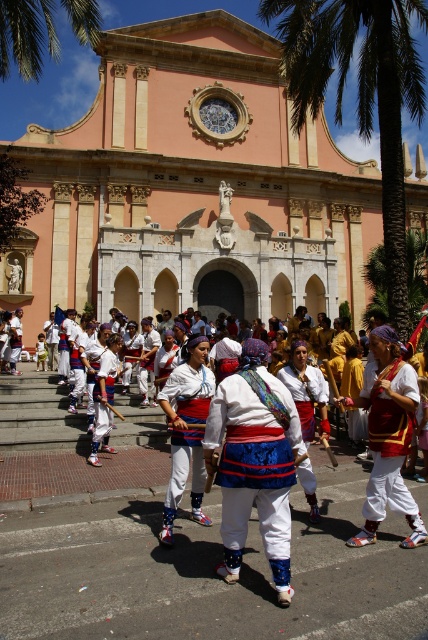
Can you confirm if white cotton skirt at center is positioned to the right of green leafy palm tree at upper left?

Yes, white cotton skirt at center is to the right of green leafy palm tree at upper left.

Is point (262, 449) positioned behind point (47, 42)?

No.

At what (x,y) coordinates should I click in order to perform the action: click on white cotton skirt at center. Please return your answer as a coordinate pair (x, y). This screenshot has height=640, width=428. Looking at the image, I should click on (253, 461).

Is point (379, 112) positioned in front of point (3, 44)?

That is False.

Which is more to the right, green leafy palm tree at right or green leafy palm tree at upper left?

green leafy palm tree at right is more to the right.

Is point (314, 60) farther from camera compared to point (47, 49)?

No, it is not.

Find the location of a particular element. This screenshot has width=428, height=640. green leafy palm tree at right is located at coordinates (360, 93).

The width and height of the screenshot is (428, 640). Find the location of `green leafy palm tree at right`. green leafy palm tree at right is located at coordinates (360, 93).

This screenshot has width=428, height=640. In order to click on green leafy palm tree at right in this screenshot , I will do `click(360, 93)`.